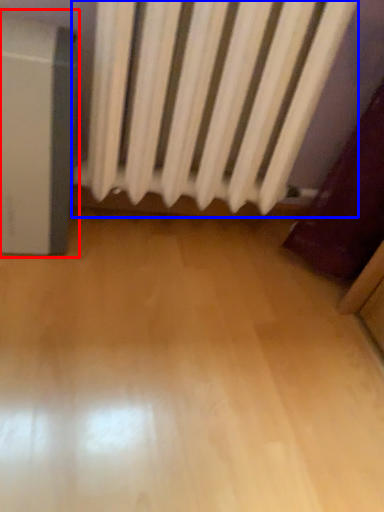
Question: Among these objects, which one is nearest to the camera, appliance (highlighted by a red box) or curtain (highlighted by a blue box)?

Choices:
 (A) appliance
 (B) curtain

Answer: (B)